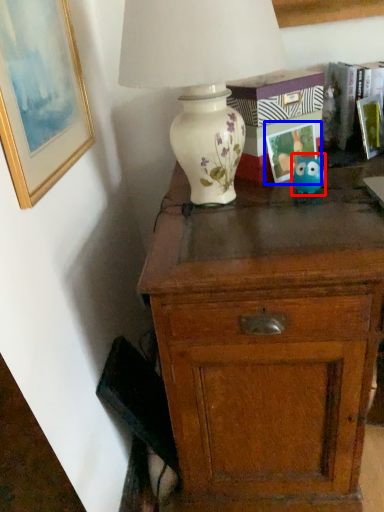
Question: Which object is closer to the camera taking this photo, toy (highlighted by a red box) or picture frame (highlighted by a blue box)?

Choices:
 (A) toy
 (B) picture frame

Answer: (A)